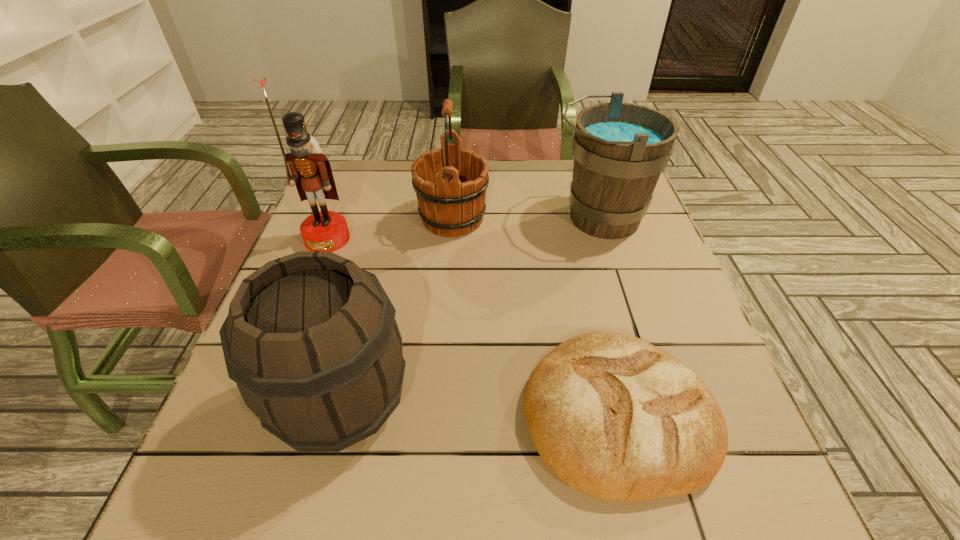
I want to click on object that is the fourth closest to the rightmost wine bucket, so click(311, 172).

Where is `object that is the second closest to the rightmost wine bucket`? The image size is (960, 540). object that is the second closest to the rightmost wine bucket is located at coordinates (614, 417).

I want to click on the second closest wine bucket to the rightmost wine bucket, so click(x=311, y=340).

Where is `the second closest wine bucket relative to the bread`? This screenshot has height=540, width=960. the second closest wine bucket relative to the bread is located at coordinates (620, 149).

Locate an element on the screen. Image resolution: width=960 pixels, height=540 pixels. vacant area in the image that satisfies the following two spatial constraints: 1. with a handle on the side of the rightmost wine bucket; 2. on the front-facing side of the nutcracker is located at coordinates (606, 239).

What are the coordinates of `blank space that satisfies the following two spatial constraints: 1. on the front-facing side of the nutcracker; 2. on the left side of the nearest wine bucket` in the screenshot? It's located at (264, 402).

This screenshot has width=960, height=540. Find the location of `free space that satisfies the following two spatial constraints: 1. on the front-facing side of the nutcracker; 2. on the right side of the nearest wine bucket`. free space that satisfies the following two spatial constraints: 1. on the front-facing side of the nutcracker; 2. on the right side of the nearest wine bucket is located at coordinates (264, 402).